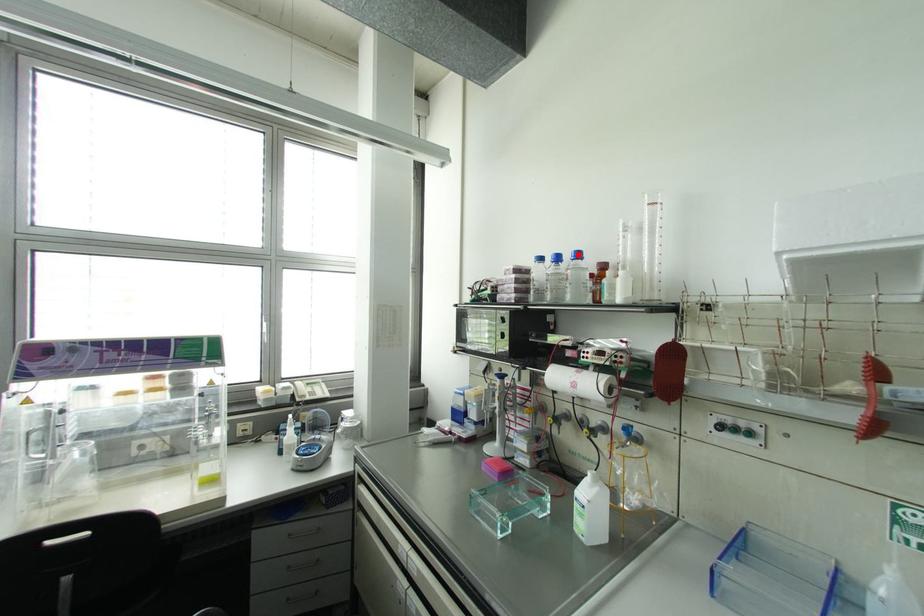
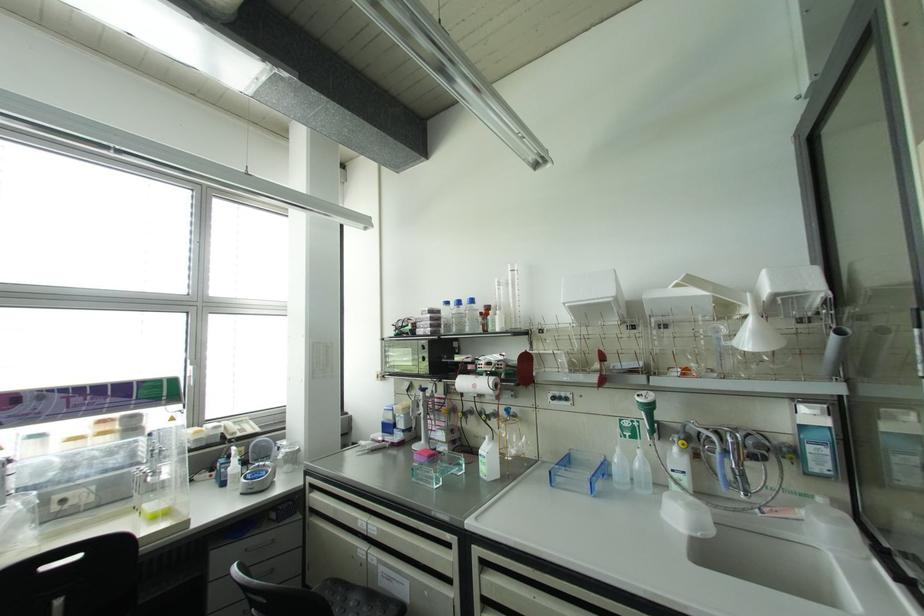
Where in the second image is the point corresponding to the highlighted location from the first image?

(471, 301)